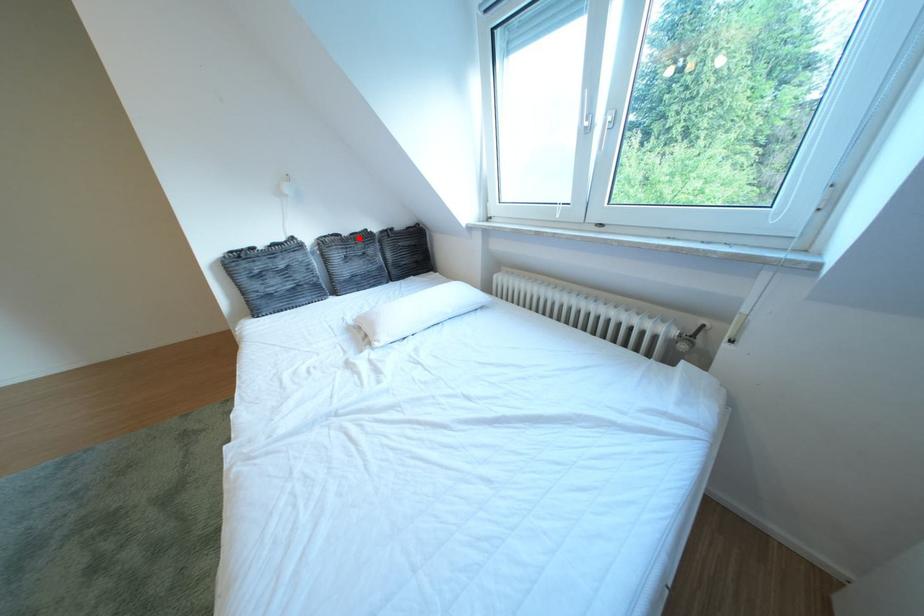
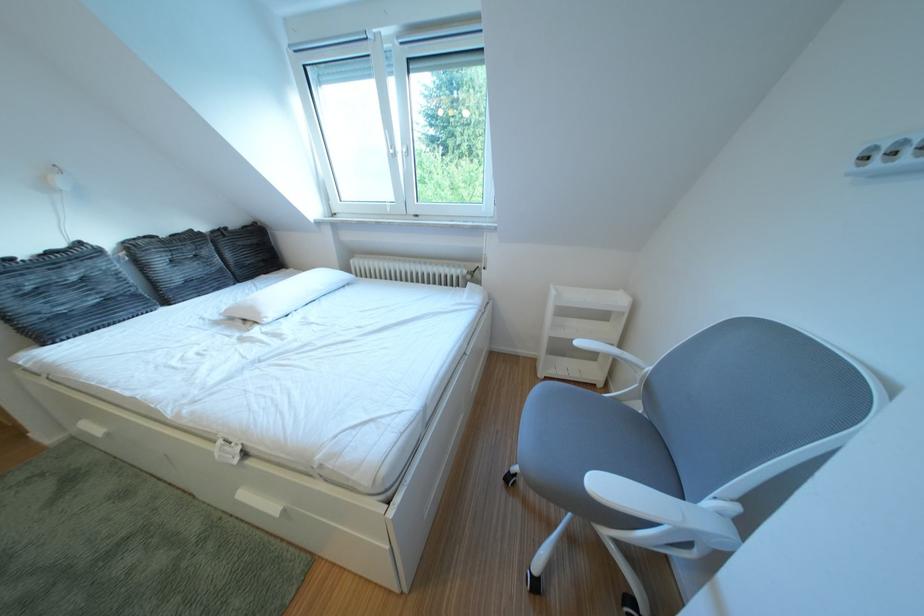
Find the pixel in the second image that matches the highlighted location in the first image.

(176, 240)